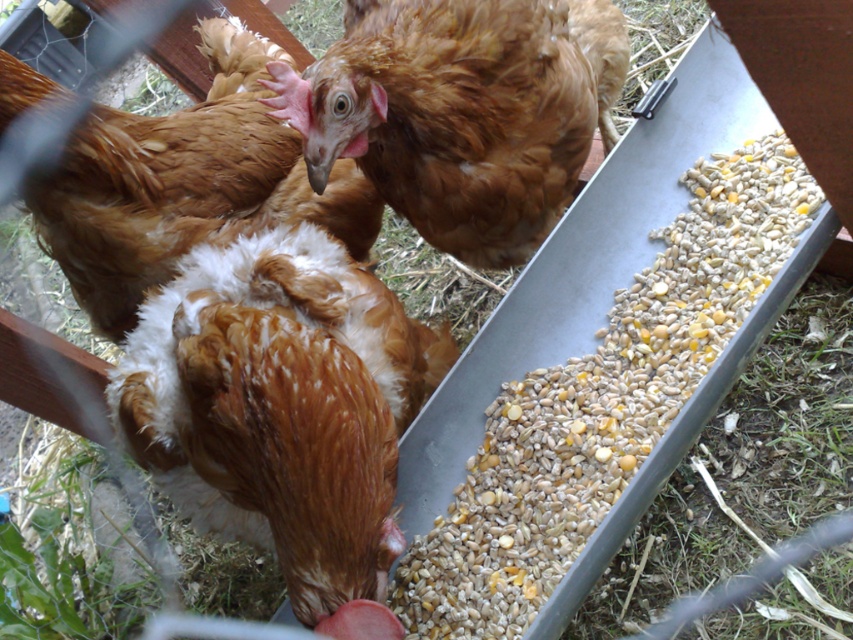
Does brown feathered chicken at center have a smaller size compared to brown fluffy chicken at center?

Indeed, brown feathered chicken at center has a smaller size compared to brown fluffy chicken at center.

Is brown feathered chicken at center wider than brown fluffy chicken at center?

Correct, the width of brown feathered chicken at center exceeds that of brown fluffy chicken at center.

Does point (428, 19) lie in front of point (146, 234)?

Yes, it is.

You are a GUI agent. You are given a task and a screenshot of the screen. Output one action in this format:
    pyautogui.click(x=<x>, y=<y>)
    Task: Click on the brown feathered chicken at center
    
    Given the screenshot: What is the action you would take?
    pyautogui.click(x=451, y=116)

Is point (323, 547) farther from camera compared to point (370, 228)?

No, (323, 547) is closer to viewer.

Measure the distance between point (262, 230) and camera.

The distance of point (262, 230) from camera is 1.69 meters.

I want to click on brown speckled feathers at center, so click(282, 410).

Is brown speckled feathers at center taller than brown feathered chicken at center?

Correct, brown speckled feathers at center is much taller as brown feathered chicken at center.

Describe the element at coordinates (282, 410) in the screenshot. The height and width of the screenshot is (640, 853). I see `brown speckled feathers at center` at that location.

I want to click on brown speckled feathers at center, so click(x=282, y=410).